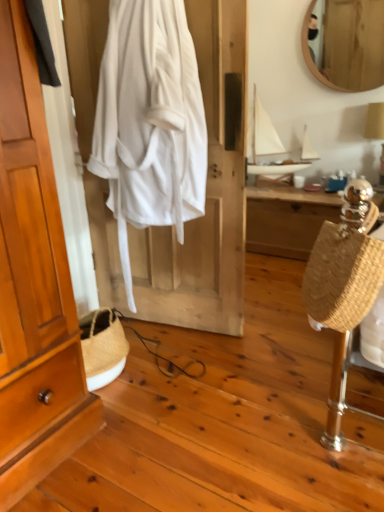
Question: Which is correct: braided straw bag at right is inside wooden mirror at upper right, or outside of it?

Choices:
 (A) inside
 (B) outside

Answer: (B)

Question: Looking at their shapes, would you say braided straw bag at right is wider or thinner than wooden mirror at upper right?

Choices:
 (A) wide
 (B) thin

Answer: (A)

Question: Which object is the closest to the wooden wardrobe at left?

Choices:
 (A) white cotton robe at center
 (B) wooden mirror at upper right
 (C) braided straw bag at right
 (D) wooden desk at center
 (E) white matte sailboat at upper center

Answer: (A)

Question: Estimate the real-world distances between objects in this image. Which object is closer to the white matte sailboat at upper center?

Choices:
 (A) wooden wardrobe at left
 (B) braided straw bag at right
 (C) white cotton robe at center
 (D) wooden desk at center
 (E) wooden mirror at upper right

Answer: (D)